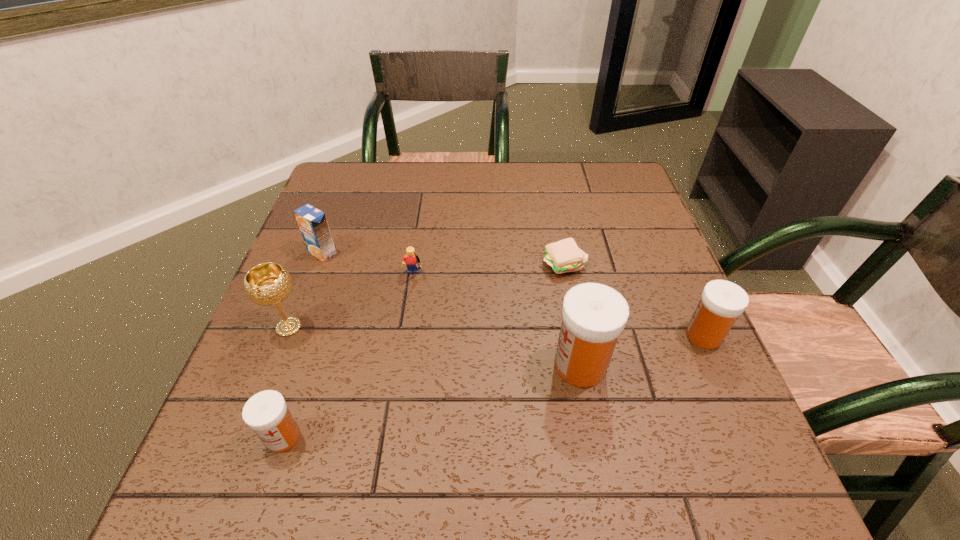
Find the location of `free point that satisfies the following two spatial constraints: 1. on the back side of the chalice; 2. on the right side of the orange_juice`. free point that satisfies the following two spatial constraints: 1. on the back side of the chalice; 2. on the right side of the orange_juice is located at coordinates (318, 253).